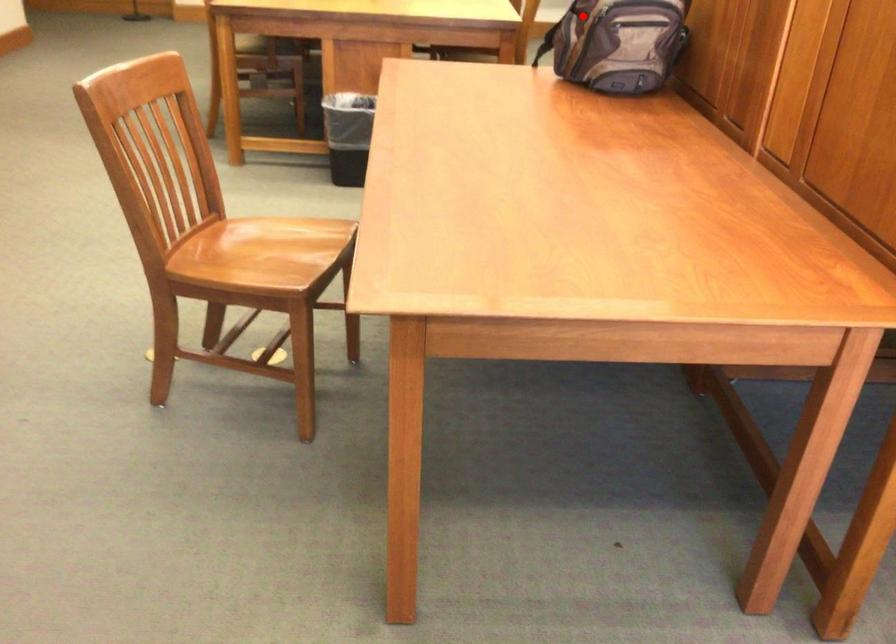
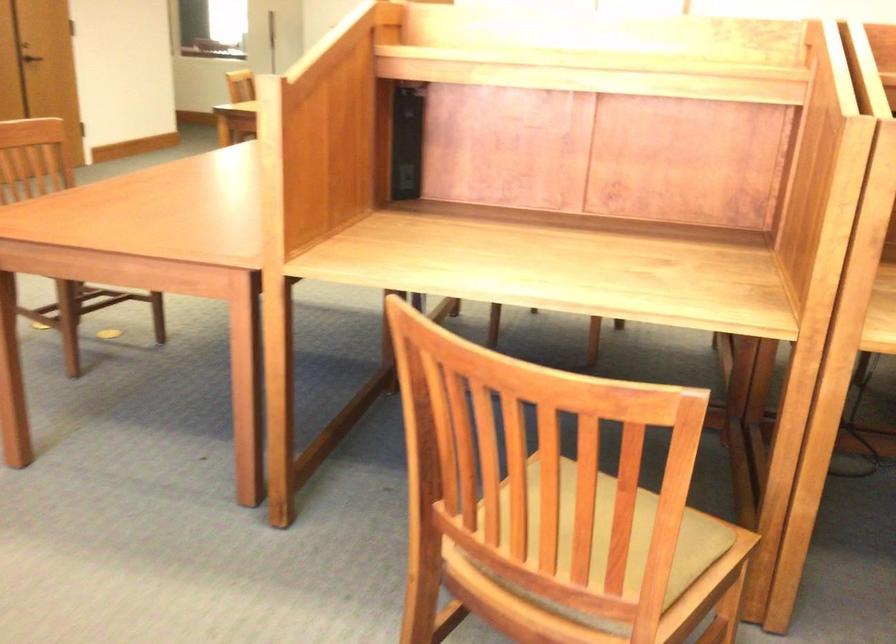
Question: I am providing you with two images of the same scene from different viewpoints. A red point is marked on the first image. Is the red point's position out of view in image 2?

Choices:
 (A) Yes
 (B) No

Answer: (A)